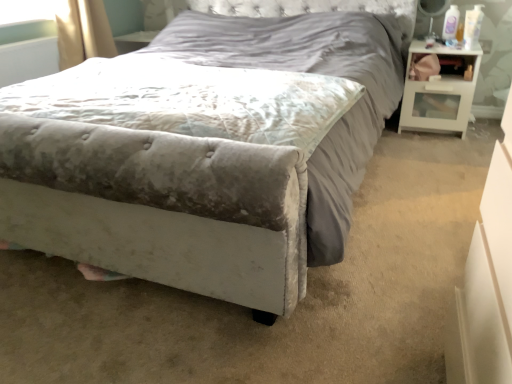
Question: Should I look upward or downward to see velvet gray bed at center?

Choices:
 (A) down
 (B) up

Answer: (B)

Question: Does white glossy nightstand at right have a larger size compared to velvet gray mattress at center?

Choices:
 (A) yes
 (B) no

Answer: (B)

Question: Is white glossy nightstand at right thinner than velvet gray mattress at center?

Choices:
 (A) yes
 (B) no

Answer: (A)

Question: Is white glossy nightstand at right looking in the opposite direction of velvet gray mattress at center?

Choices:
 (A) yes
 (B) no

Answer: (B)

Question: Is white glossy nightstand at right to the right of velvet gray mattress at center from the viewer's perspective?

Choices:
 (A) no
 (B) yes

Answer: (B)

Question: Can you confirm if white glossy nightstand at right is smaller than velvet gray mattress at center?

Choices:
 (A) yes
 (B) no

Answer: (A)

Question: Can you confirm if white glossy nightstand at right is shorter than velvet gray mattress at center?

Choices:
 (A) no
 (B) yes

Answer: (A)

Question: Is velvet gray mattress at center further to the viewer compared to white glossy nightstand at right?

Choices:
 (A) no
 (B) yes

Answer: (A)

Question: Is velvet gray mattress at center looking in the opposite direction of white glossy nightstand at right?

Choices:
 (A) no
 (B) yes

Answer: (A)

Question: Is velvet gray mattress at center to the left of white glossy nightstand at right from the viewer's perspective?

Choices:
 (A) yes
 (B) no

Answer: (A)

Question: Would you say velvet gray mattress at center is outside white glossy nightstand at right?

Choices:
 (A) no
 (B) yes

Answer: (B)

Question: Are velvet gray mattress at center and white glossy nightstand at right beside each other?

Choices:
 (A) yes
 (B) no

Answer: (B)

Question: From a real-world perspective, is velvet gray mattress at center located higher than white glossy nightstand at right?

Choices:
 (A) no
 (B) yes

Answer: (B)

Question: From the image's perspective, is velvet gray mattress at center beneath velvet gray bed at center?

Choices:
 (A) no
 (B) yes

Answer: (B)